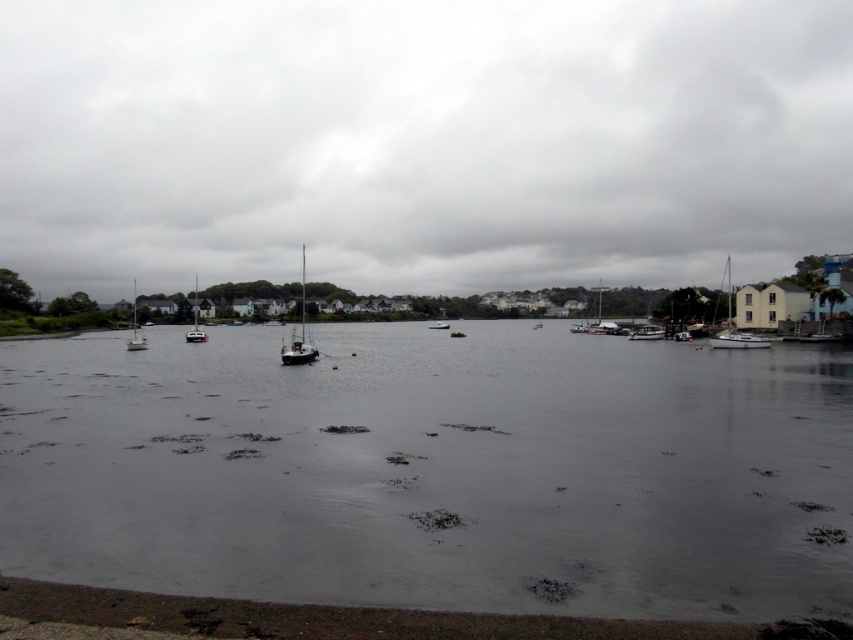
Which of these two, white matte sailboat at left or white matte boat at center, stands taller?

white matte sailboat at left is taller.

Between point (132, 292) and point (436, 323), which one is positioned behind?

Positioned behind is point (132, 292).

Identify the location of white matte sailboat at left. (135, 328).

Is white matte sailboat at right to the right of white glossy boat at center from the viewer's perspective?

Indeed, white matte sailboat at right is positioned on the right side of white glossy boat at center.

Describe the element at coordinates (735, 330) in the screenshot. I see `white matte sailboat at right` at that location.

Locate an element on the screen. This screenshot has width=853, height=640. white matte sailboat at right is located at coordinates (735, 330).

Who is taller, white glossy sailboat at center-right or white plastic sailboat at center-left?

white plastic sailboat at center-left

In the scene shown: Can you confirm if white glossy sailboat at center-right is positioned to the left of white plastic sailboat at center-left?

In fact, white glossy sailboat at center-right is to the right of white plastic sailboat at center-left.

Is point (601, 301) in front of point (198, 339)?

No, (601, 301) is behind (198, 339).

Where is `white glossy sailboat at center-right`? white glossy sailboat at center-right is located at coordinates pos(601,314).